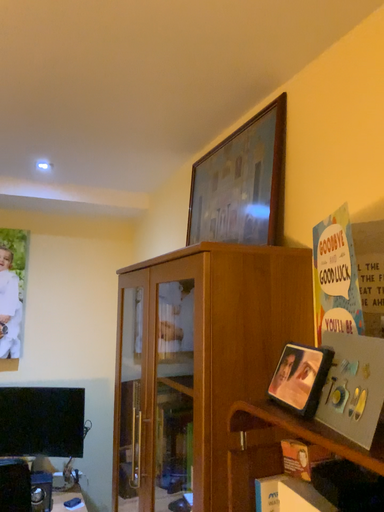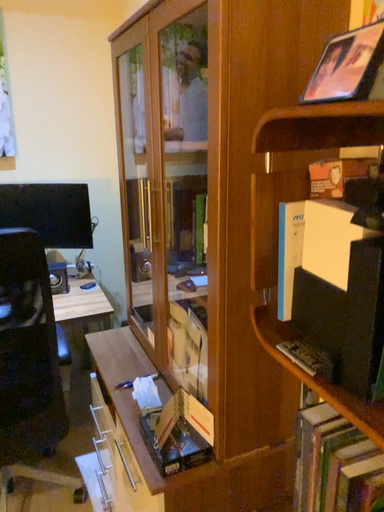
Question: Which way did the camera rotate in the video?

Choices:
 (A) rotated downward
 (B) rotated upward

Answer: (A)